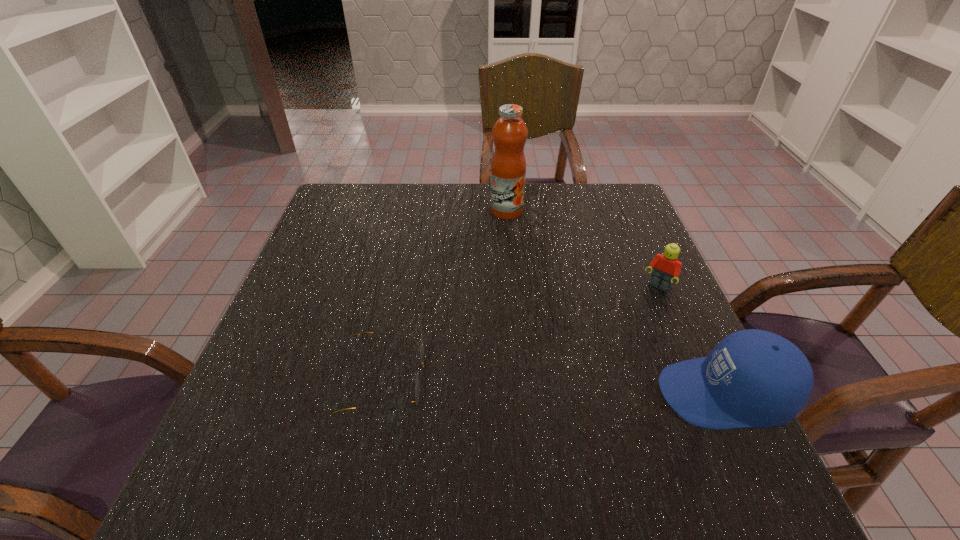
At what (x,y) coordinates should I click in order to perform the action: click on free space located 0.070m on the front label of the fruit juice. Please return your answer as a coordinate pair (x, y). This screenshot has width=960, height=540. Looking at the image, I should click on (517, 235).

In order to click on free point located on the front label of the fruit juice in this screenshot , I will do [538, 281].

The image size is (960, 540). In order to click on vacant point located 0.190m on the front label of the fruit juice in this screenshot , I will do `click(530, 262)`.

I want to click on free spot located on the face of the third nearest object, so click(x=588, y=381).

I want to click on vacant point located on the face of the third nearest object, so click(614, 346).

The width and height of the screenshot is (960, 540). Identify the location of free region located on the face of the third nearest object. (570, 407).

Image resolution: width=960 pixels, height=540 pixels. Identify the location of object that is at the far edge. (508, 167).

Where is `spectacles at the near edge`? This screenshot has width=960, height=540. spectacles at the near edge is located at coordinates (422, 348).

Locate an element on the screen. cap located in the near edge section of the desktop is located at coordinates (753, 378).

In order to click on cap that is positioned at the right edge in this screenshot , I will do `click(753, 378)`.